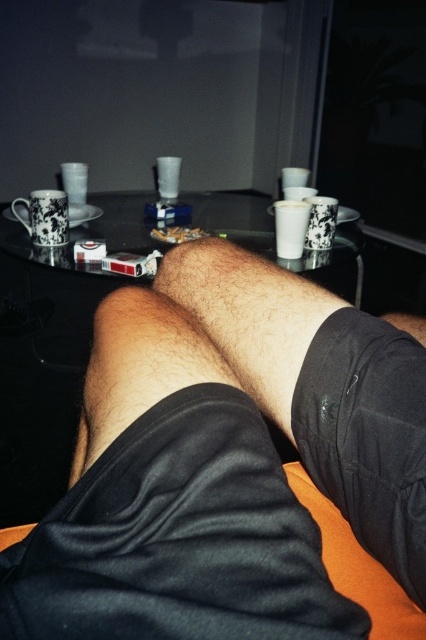
Question: From the image, what is the correct spatial relationship of black cotton leg at center in relation to transparent glass table at center?

Choices:
 (A) left
 (B) right

Answer: (B)

Question: Does black cotton leg at center appear over transparent glass table at center?

Choices:
 (A) no
 (B) yes

Answer: (A)

Question: Is black cotton leg at center to the left of transparent glass table at center from the viewer's perspective?

Choices:
 (A) no
 (B) yes

Answer: (A)

Question: Which object is farther from the camera taking this photo?

Choices:
 (A) black cotton leg at center
 (B) transparent glass table at center

Answer: (B)